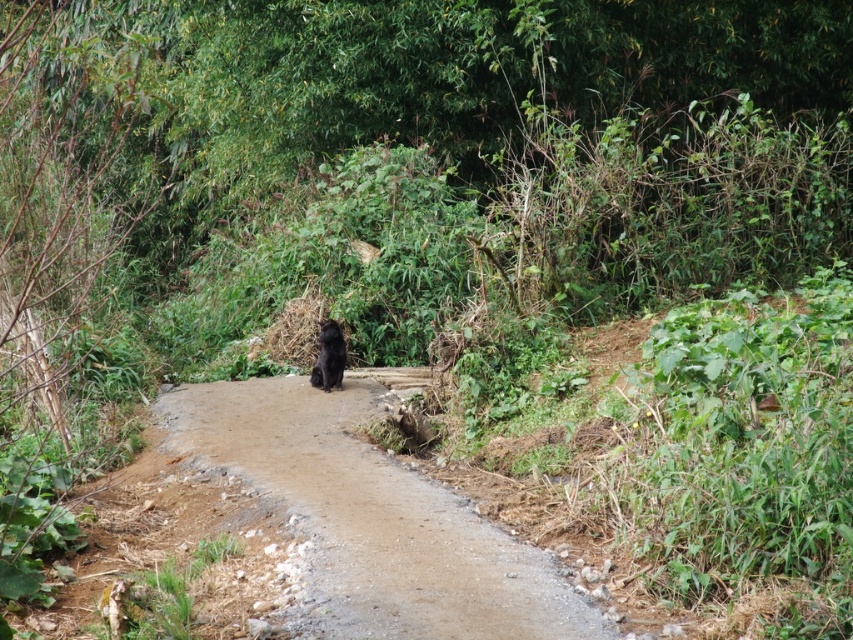
In the scene shown: You are a hiker trying to navigate the narrow dirt road at center. There is a black furry dog at center blocking your path. Can you pass around the dog without stepping off the road?

The dirt road at center is smaller than the black furry dog at center, so there may not be enough space to pass around the dog without leaving the road. It is advisable to wait for the dog to move or find an alternative route.

You are a hiker trying to navigate through the rural area. You see the dirt road at center. Based on its 2D location coordinates, can you determine whether it is positioned more towards the left or right side of the image?

The dirt road at center is located at coordinates point (372, 518). Since the x coordinate is 0.812, which is closer to 1.0 than to 0.0, the dirt road at center is positioned more towards the right side of the image.